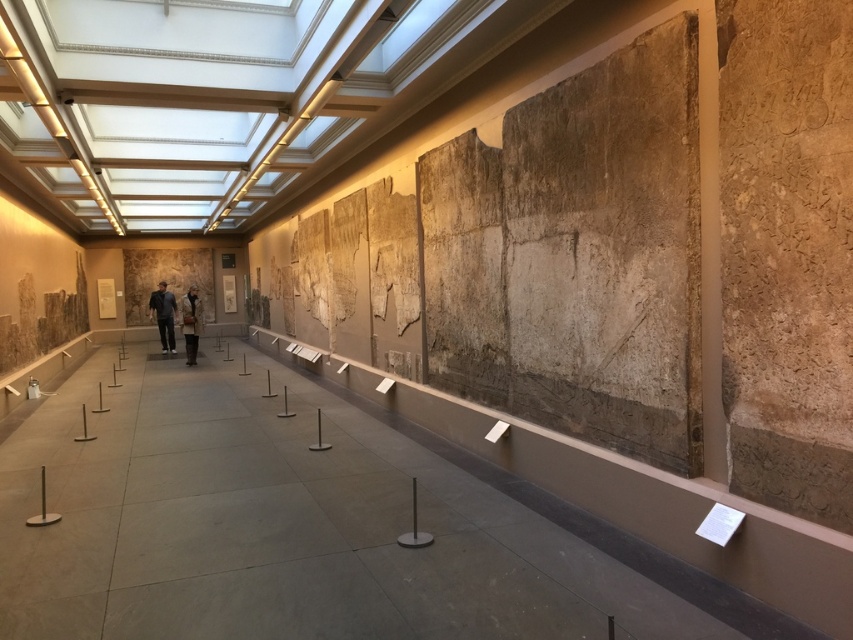
Is the position of dark gray fabric jacket at center less distant than that of brown wool coat at center?

No, it is behind brown wool coat at center.

Does point (155, 310) lie behind point (194, 332)?

Yes.

Where is `dark gray fabric jacket at center`? dark gray fabric jacket at center is located at coordinates (163, 316).